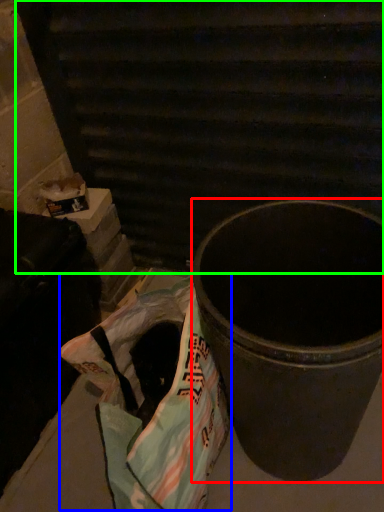
Question: Considering the real-world distances, which object is closest to waste container (highlighted by a red box)? grocery bag (highlighted by a blue box) or stairwell (highlighted by a green box).

Choices:
 (A) grocery bag
 (B) stairwell

Answer: (A)